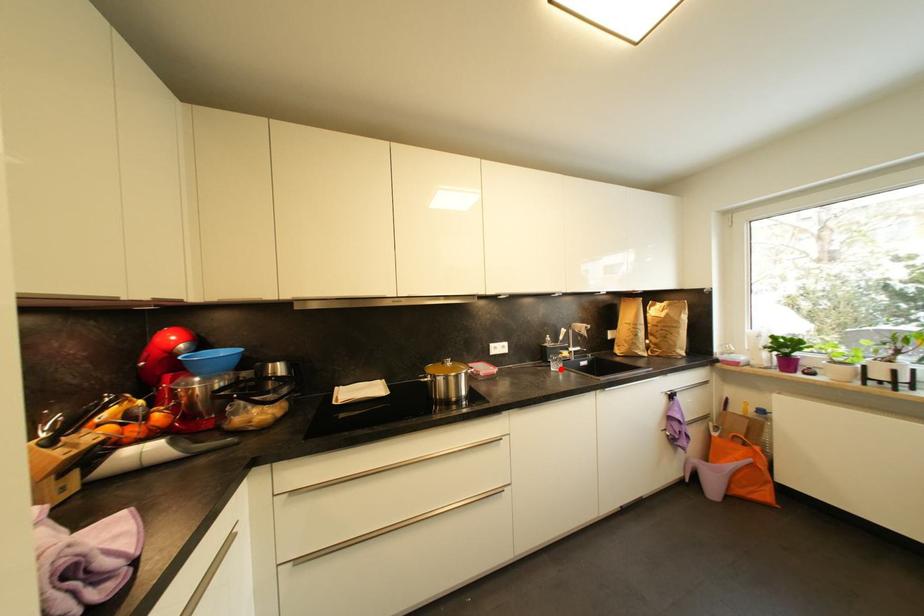
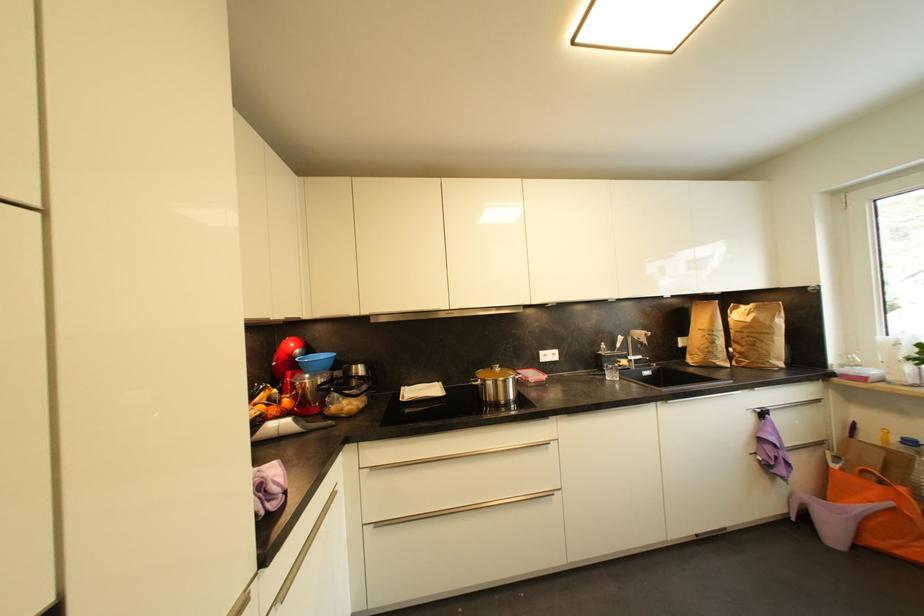
In the second image, find the point that corresponds to the highlighted location in the first image.

(616, 378)